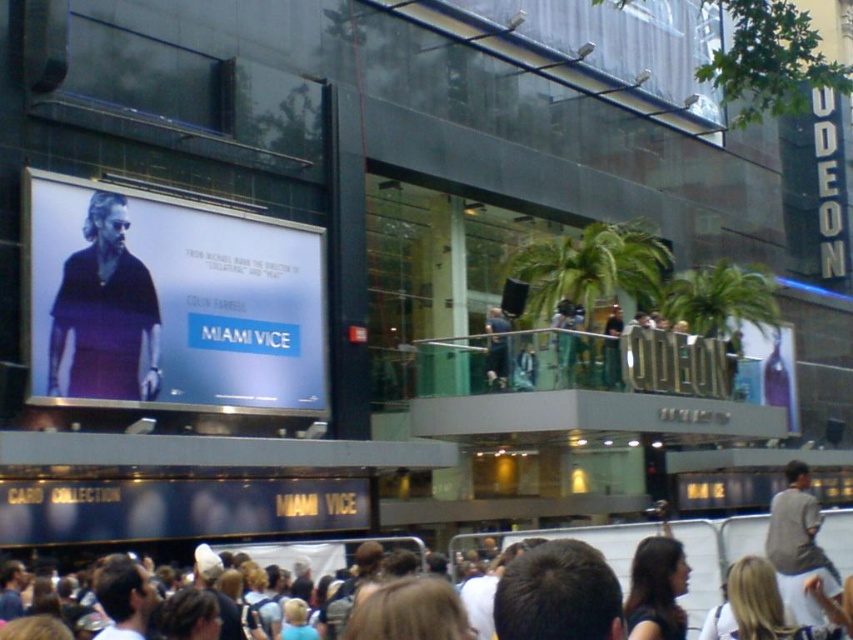
You are a photographer trying to capture a clear shot of both the brown hair at center and the matte black jacket at upper center. Based on their positions and sizes, which object should you focus on first to ensure both are in frame?

The brown hair at center might be wider than the matte black jacket at upper center, so focusing on the brown hair at center first would help ensure both are in frame since it requires a wider angle or closer distance to capture its size compared to the matte black jacket at upper center.